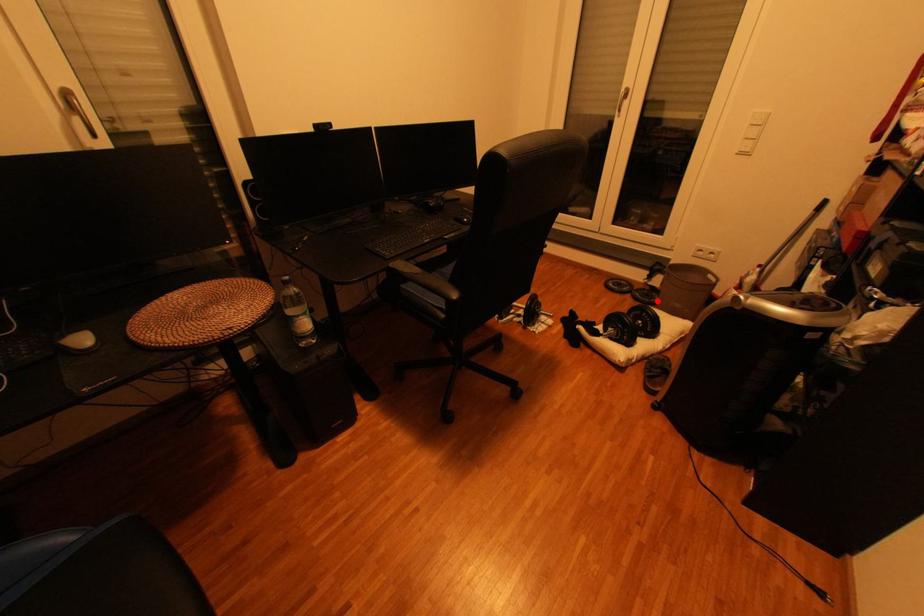
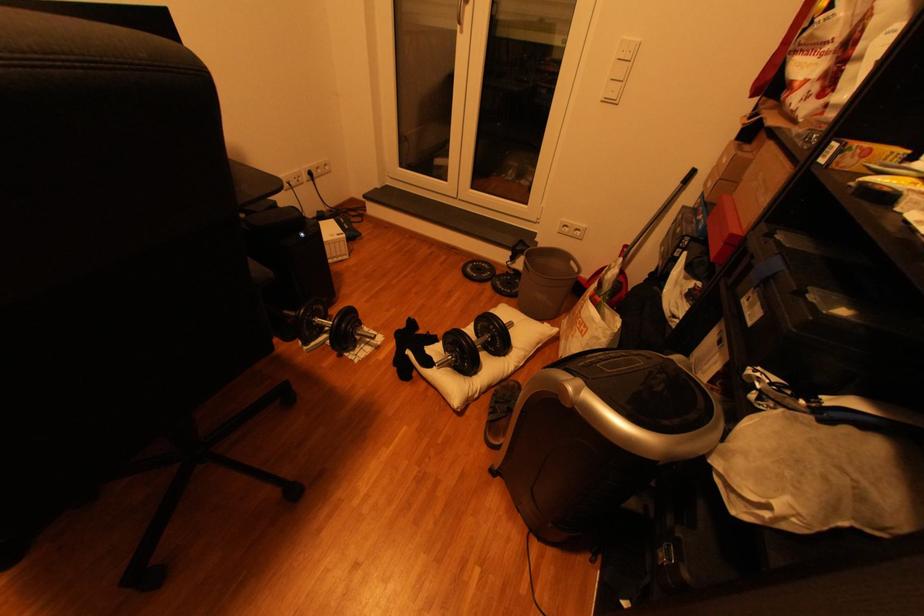
Question: I am providing you with two images of the same scene from different viewpoints. A red point is marked on the first image. At the location where the point appears in image 1, is it still visible in image 2?

Choices:
 (A) Yes
 (B) No

Answer: (A)